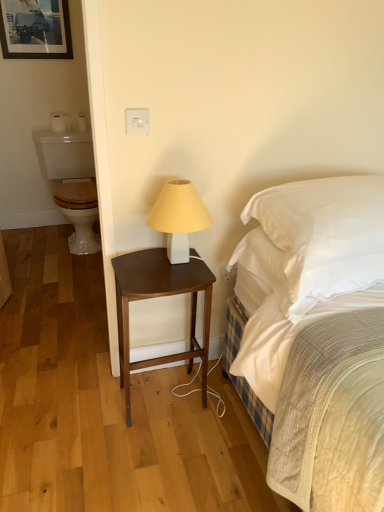
At what (x,y) coordinates should I click in order to perform the action: click on blank space situated above dark wood nightstand at center (from a real-world perspective). Please return your answer as a coordinate pair (x, y). This screenshot has height=512, width=384. Looking at the image, I should click on (163, 268).